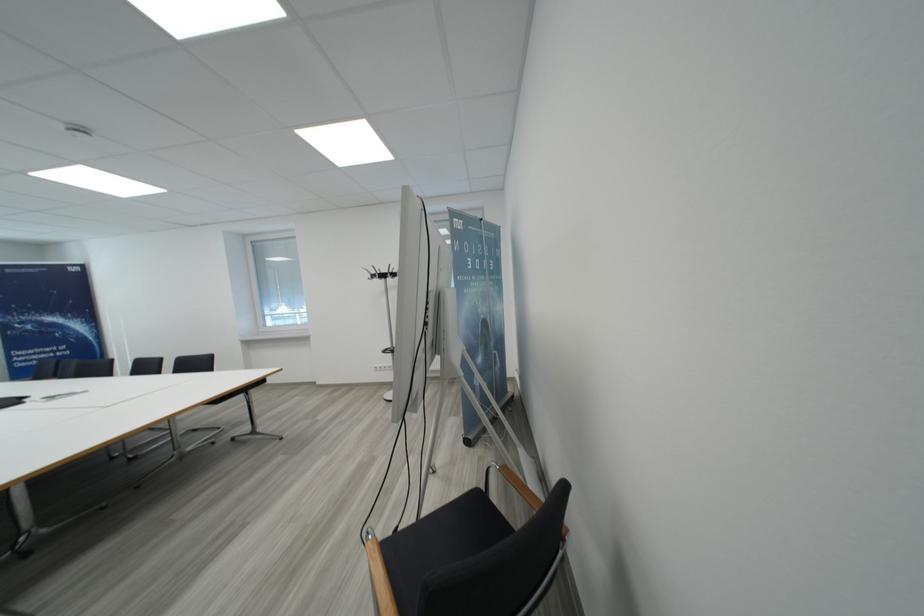
Locate an element on the screen. This screenshot has height=616, width=924. black chair sitting surface is located at coordinates (444, 536).